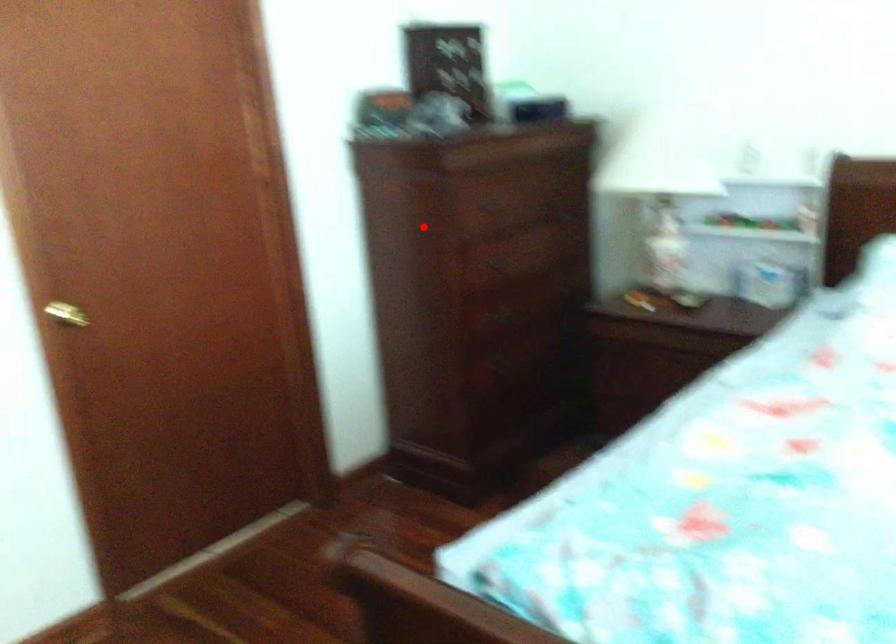
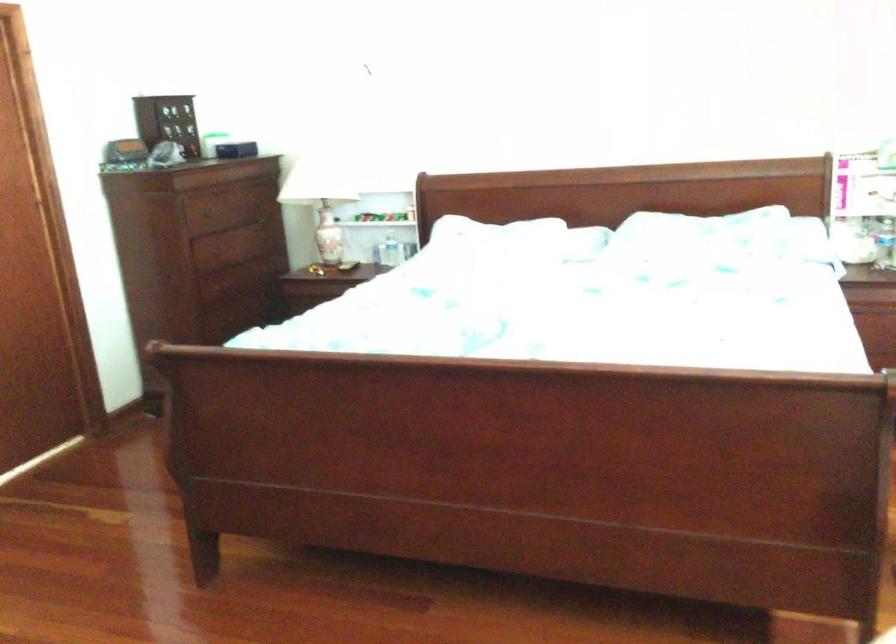
In the second image, find the point that corresponds to the highlighted location in the first image.

(209, 252)